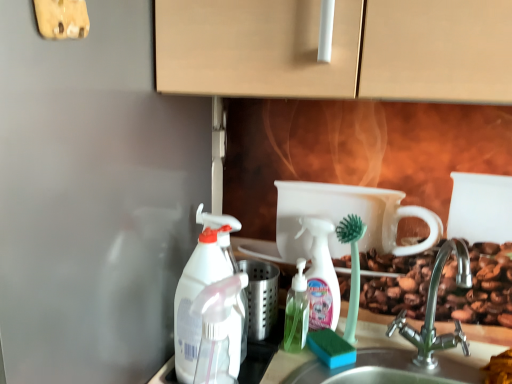
Question: From the image's perspective, is satin nickel faucet at lower right above green translucent soap dispenser at center?

Choices:
 (A) no
 (B) yes

Answer: (B)

Question: Is satin nickel faucet at lower right to the left of green translucent soap dispenser at center from the viewer's perspective?

Choices:
 (A) no
 (B) yes

Answer: (A)

Question: From the image's perspective, would you say satin nickel faucet at lower right is shown under green translucent soap dispenser at center?

Choices:
 (A) no
 (B) yes

Answer: (A)

Question: Is the position of satin nickel faucet at lower right less distant than that of green translucent soap dispenser at center?

Choices:
 (A) no
 (B) yes

Answer: (B)

Question: Can you confirm if satin nickel faucet at lower right is wider than green translucent soap dispenser at center?

Choices:
 (A) yes
 (B) no

Answer: (A)

Question: From the image's perspective, is white plastic spray bottle at left, the first cleaning product viewed from the left, above or below satin nickel faucet at lower right?

Choices:
 (A) above
 (B) below

Answer: (A)

Question: In terms of width, does white plastic spray bottle at left, marked as the third cleaning product in a right-to-left arrangement, look wider or thinner when compared to satin nickel faucet at lower right?

Choices:
 (A) thin
 (B) wide

Answer: (A)

Question: From a real-world perspective, relative to satin nickel faucet at lower right, is white plastic spray bottle at left, the first cleaning product viewed from the left, vertically above or below?

Choices:
 (A) below
 (B) above

Answer: (B)

Question: Which is correct: white plastic spray bottle at left, marked as the third cleaning product in a right-to-left arrangement, is inside satin nickel faucet at lower right, or outside of it?

Choices:
 (A) outside
 (B) inside

Answer: (A)

Question: Is transparent plastic spray bottle at left, which appears as the second cleaning product when viewed from the right, spatially inside satin nickel faucet at lower right, or outside of it?

Choices:
 (A) outside
 (B) inside

Answer: (A)

Question: Considering the positions of point (215, 377) and point (415, 364), is point (215, 377) closer or farther from the camera than point (415, 364)?

Choices:
 (A) farther
 (B) closer

Answer: (B)

Question: From a real-world perspective, is transparent plastic spray bottle at left, acting as the 3th cleaning product starting from the back, positioned above or below satin nickel faucet at lower right?

Choices:
 (A) below
 (B) above

Answer: (A)

Question: From the image's perspective, is transparent plastic spray bottle at left, acting as the 3th cleaning product starting from the back, located above or below satin nickel faucet at lower right?

Choices:
 (A) above
 (B) below

Answer: (B)

Question: From a real-world perspective, is translucent plastic spray bottle at center, which appears as the third cleaning product when viewed from the front, physically located above or below satin nickel faucet at lower right?

Choices:
 (A) above
 (B) below

Answer: (A)

Question: Is translucent plastic spray bottle at center, the 1th cleaning product positioned from the right, in front of or behind satin nickel faucet at lower right in the image?

Choices:
 (A) behind
 (B) front

Answer: (A)